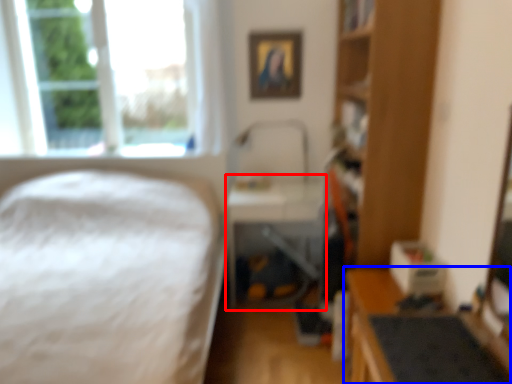
Question: Which point is closer to the camera, table (highlighted by a red box) or workbench (highlighted by a blue box)?

Choices:
 (A) table
 (B) workbench

Answer: (B)